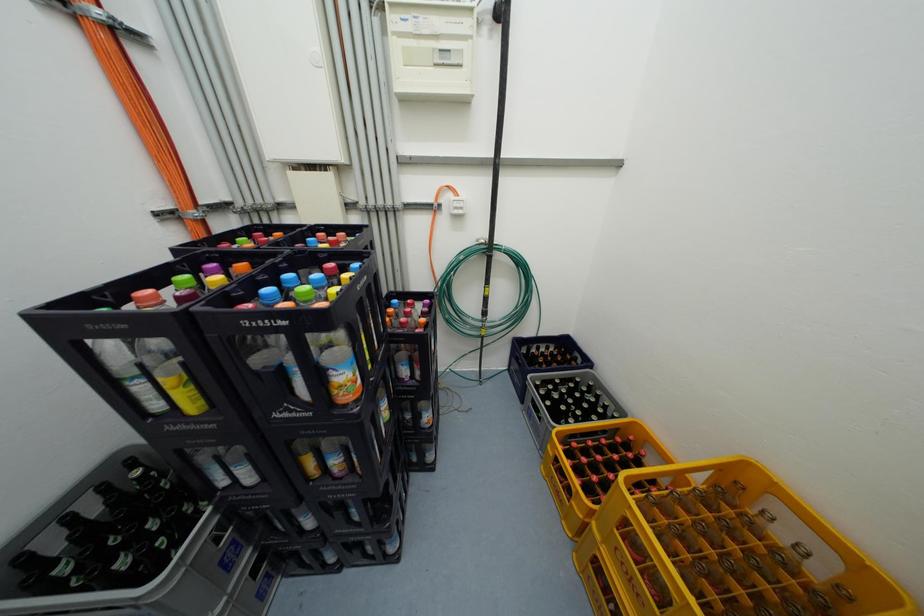
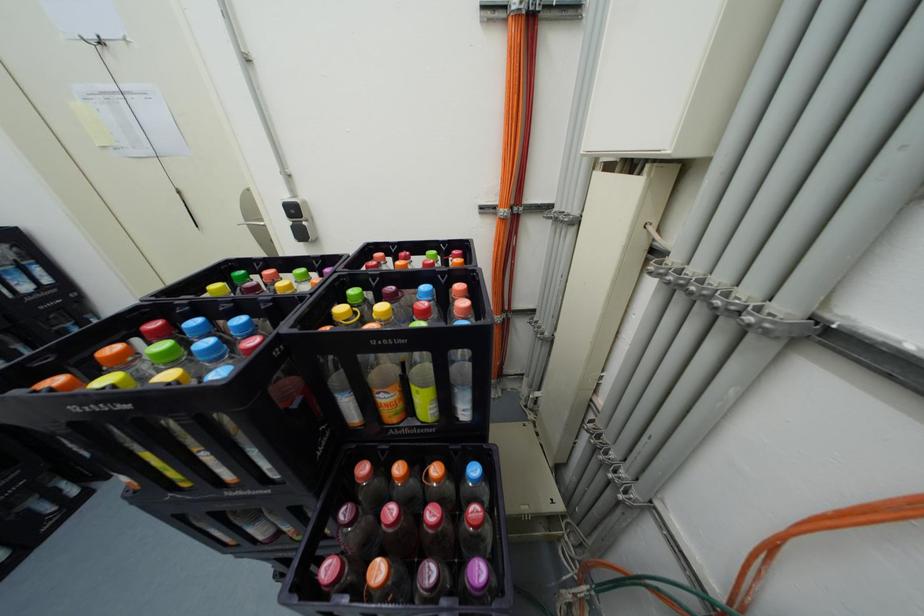
First-person continuous shooting, in which direction is the camera rotating?

The camera's rotation is toward left-down.